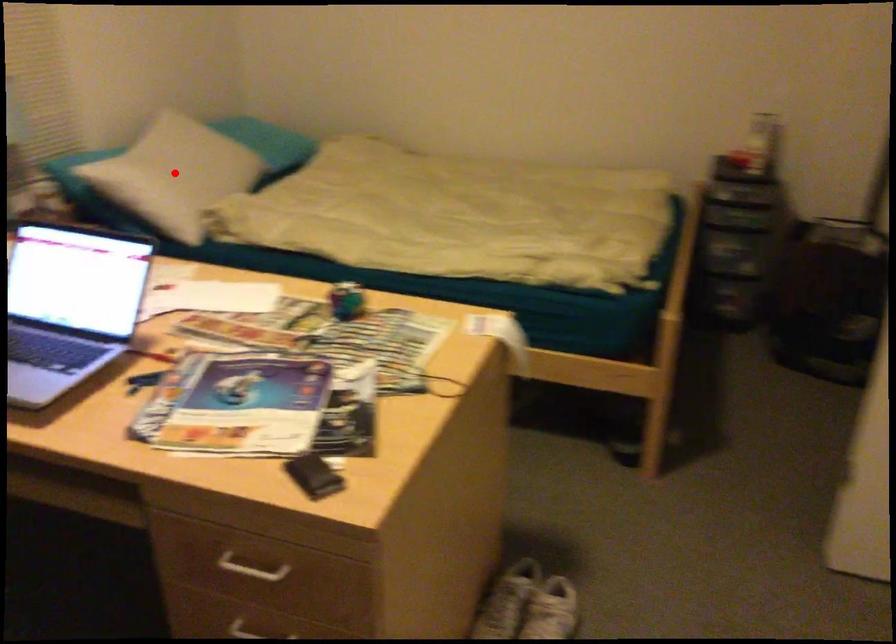
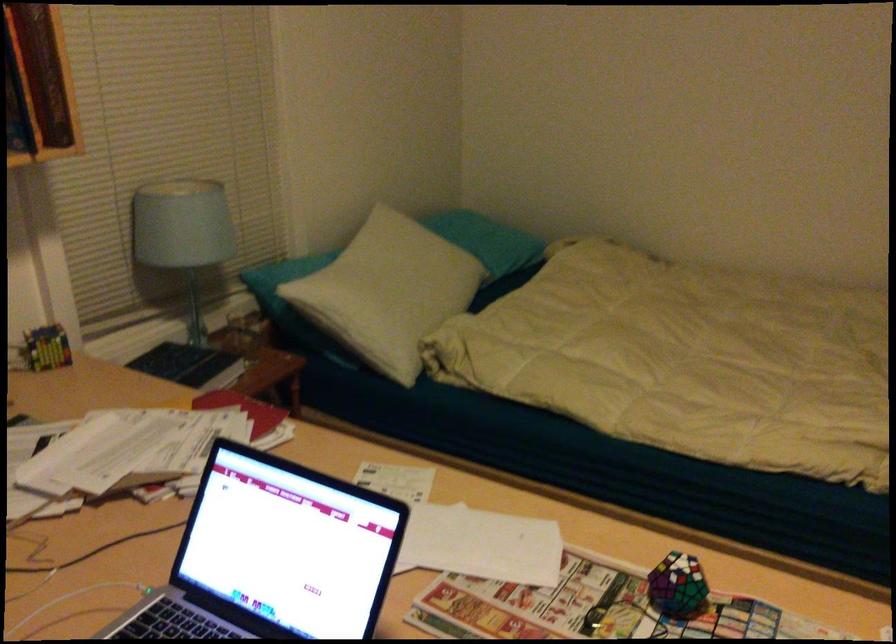
In the second image, find the point that corresponds to the highlighted location in the first image.

(389, 292)